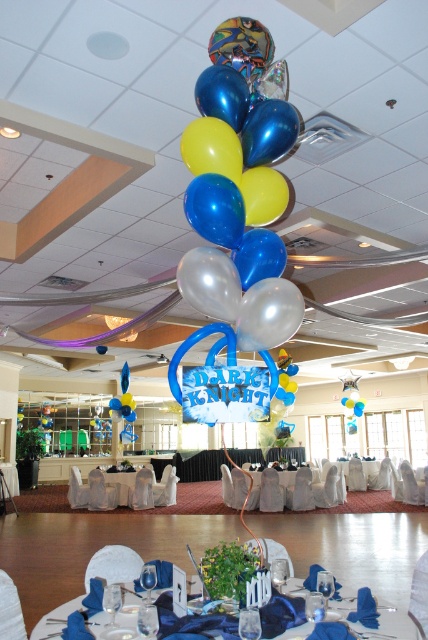
Question: Is blue metallic balloon at center bigger than white fabric table at center?

Choices:
 (A) yes
 (B) no

Answer: (B)

Question: Which is farther from the white fabric table at center?

Choices:
 (A) blue satin tablecloth at center
 (B) white glossy table at center

Answer: (A)

Question: Considering the real-world distances, which object is farthest from the white glossy table at center?

Choices:
 (A) blue metallic balloon at center
 (B) white fabric table at center

Answer: (A)

Question: Can you confirm if white fabric table at center is thinner than white glossy table at center?

Choices:
 (A) no
 (B) yes

Answer: (A)

Question: Is blue metallic balloon at center wider than white fabric table at center?

Choices:
 (A) yes
 (B) no

Answer: (B)

Question: Which is farther from the white fabric table at center?

Choices:
 (A) blue metallic balloon at center
 (B) white glossy table at center
 (C) blue satin tablecloth at center

Answer: (A)